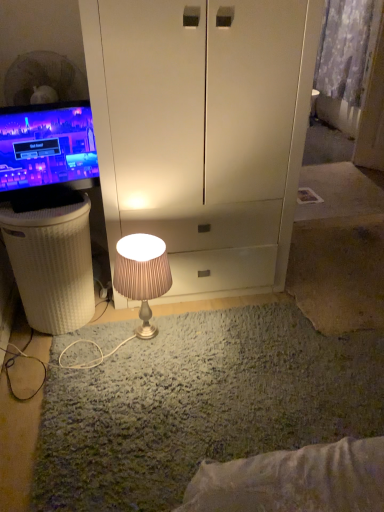
Question: Is satin beige lamp at center turned away from matte black monitor at left?

Choices:
 (A) no
 (B) yes

Answer: (A)

Question: Are satin beige lamp at center and matte black monitor at left making contact?

Choices:
 (A) yes
 (B) no

Answer: (B)

Question: Is satin beige lamp at center to the left of matte black monitor at left from the viewer's perspective?

Choices:
 (A) yes
 (B) no

Answer: (B)

Question: From the image's perspective, is satin beige lamp at center beneath matte black monitor at left?

Choices:
 (A) yes
 (B) no

Answer: (A)

Question: From the image's perspective, is satin beige lamp at center on top of matte black monitor at left?

Choices:
 (A) yes
 (B) no

Answer: (B)

Question: From a real-world perspective, is satin beige lamp at center positioned under matte black monitor at left based on gravity?

Choices:
 (A) no
 (B) yes

Answer: (B)

Question: Considering the relative sizes of matte black monitor at left and satin beige lamp at center in the image provided, is matte black monitor at left taller than satin beige lamp at center?

Choices:
 (A) no
 (B) yes

Answer: (A)

Question: Could you tell me if matte black monitor at left is turned towards satin beige lamp at center?

Choices:
 (A) no
 (B) yes

Answer: (A)

Question: From the image's perspective, does matte black monitor at left appear higher than satin beige lamp at center?

Choices:
 (A) no
 (B) yes

Answer: (B)

Question: From a real-world perspective, does matte black monitor at left stand above satin beige lamp at center?

Choices:
 (A) no
 (B) yes

Answer: (B)

Question: Is matte black monitor at left surrounding satin beige lamp at center?

Choices:
 (A) no
 (B) yes

Answer: (A)

Question: Considering the relative sizes of matte black monitor at left and satin beige lamp at center in the image provided, is matte black monitor at left bigger than satin beige lamp at center?

Choices:
 (A) yes
 (B) no

Answer: (B)

Question: Is matte black monitor at left positioned beyond the bounds of white wicker basket at left?

Choices:
 (A) no
 (B) yes

Answer: (B)